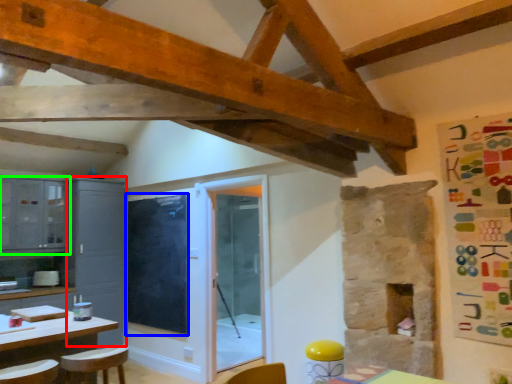
Question: Which is nearer to the cabinetry (highlighted by a red box)? window screen (highlighted by a blue box) or cabinetry (highlighted by a green box).

Choices:
 (A) window screen
 (B) cabinetry

Answer: (A)